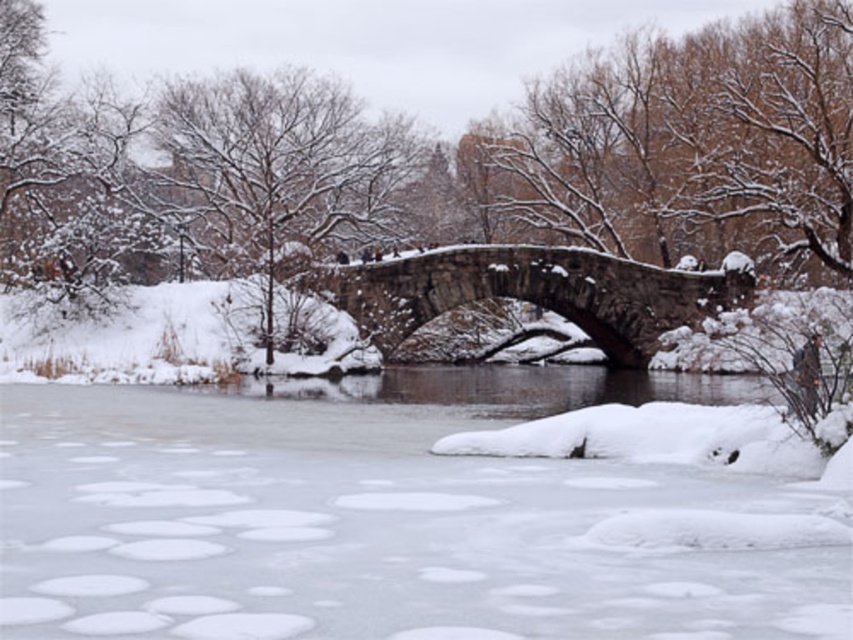
Measure the distance between transparent ice at center and gray stone bridge at center.

A distance of 21.43 meters exists between transparent ice at center and gray stone bridge at center.

Does point (634, 525) come farther from viewer compared to point (552, 289)?

No, (634, 525) is in front of (552, 289).

Find the location of a particular element. Image resolution: width=853 pixels, height=640 pixels. transparent ice at center is located at coordinates (378, 518).

Which of these two, snow-covered tree at upper center or gray stone bridge at center, stands taller?

With more height is snow-covered tree at upper center.

Is snow-covered tree at upper center positioned at the back of gray stone bridge at center?

No, snow-covered tree at upper center is closer to the viewer.

Does point (384, 189) lie behind point (469, 298)?

Yes, point (384, 189) is behind point (469, 298).

This screenshot has width=853, height=640. Identify the location of snow-covered tree at upper center. (283, 170).

The image size is (853, 640). Find the location of `transparent ice at center`. transparent ice at center is located at coordinates (378, 518).

In the scene shown: Does transparent ice at center come in front of snow-covered tree at upper center?

Yes, it is in front of snow-covered tree at upper center.

The height and width of the screenshot is (640, 853). I want to click on transparent ice at center, so click(378, 518).